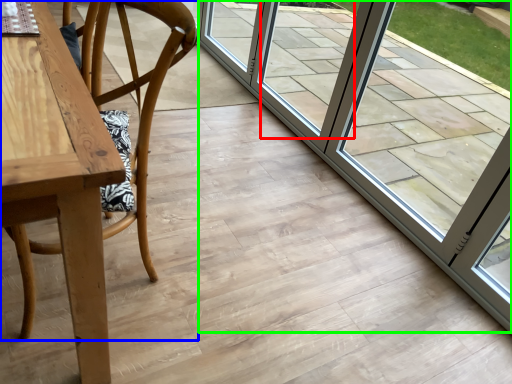
Question: Considering the real-world distances, which object is farthest from window (highlighted by a red box)? chair (highlighted by a blue box) or door (highlighted by a green box)?

Choices:
 (A) chair
 (B) door

Answer: (A)